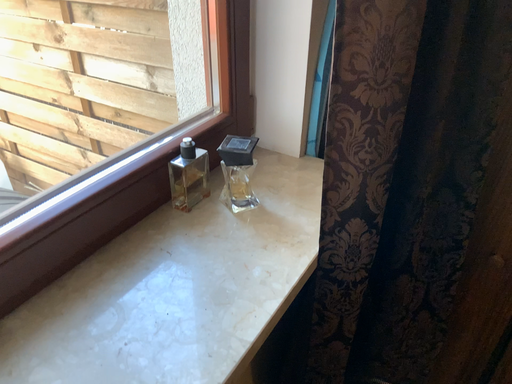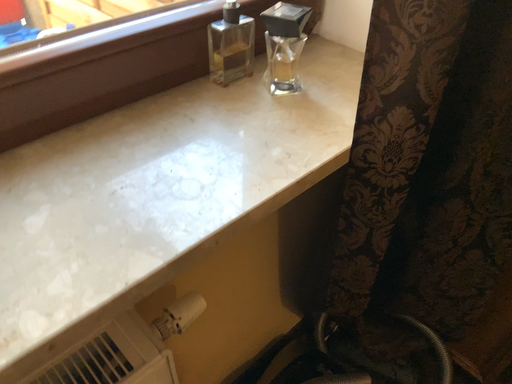
Question: Which way did the camera rotate in the video?

Choices:
 (A) rotated left
 (B) rotated right

Answer: (A)